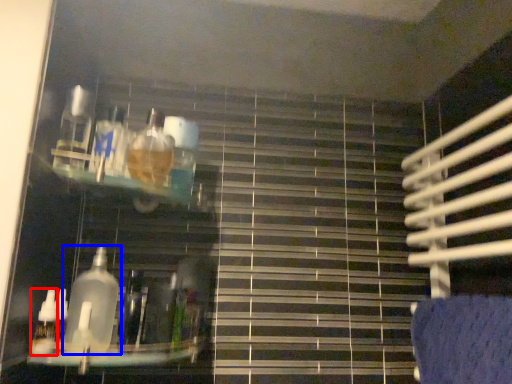
Question: Which object is further to the camera taking this photo, bottle (highlighted by a red box) or bottle (highlighted by a blue box)?

Choices:
 (A) bottle
 (B) bottle

Answer: (A)